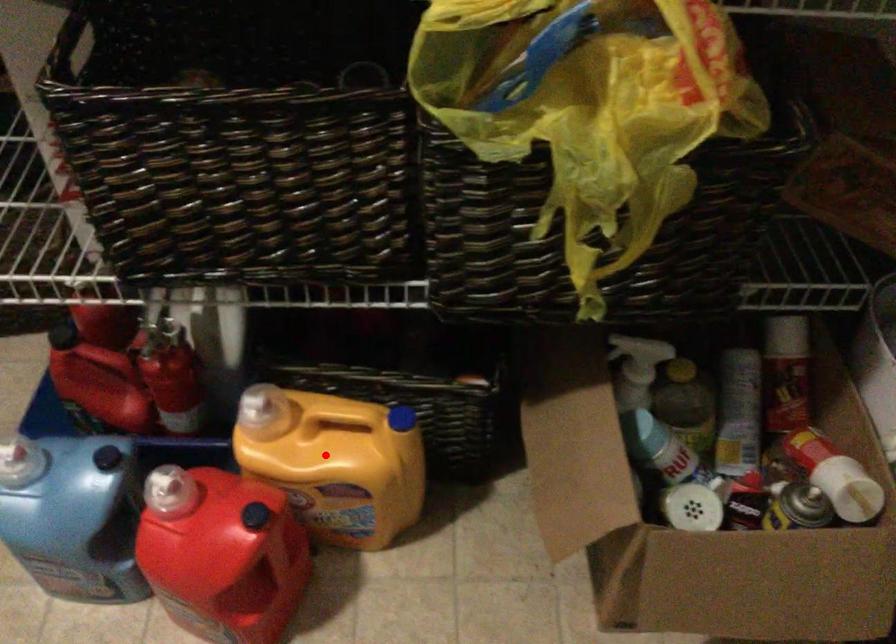
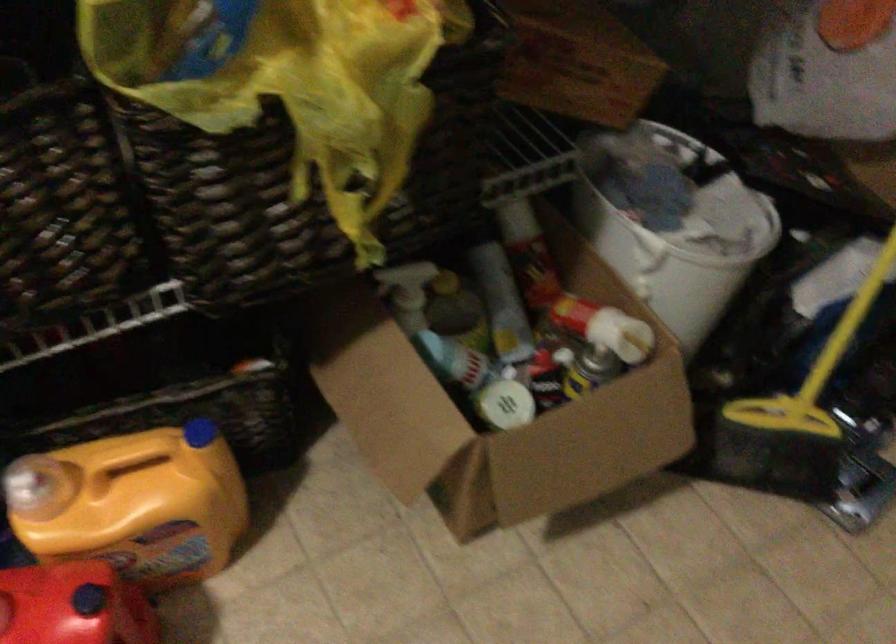
Question: I am providing you with two images of the same scene from different viewpoints. A red point is shown in image1. For the corresponding object point in image2, is it positioned nearer or farther from the camera?

Choices:
 (A) Nearer
 (B) Farther

Answer: (A)